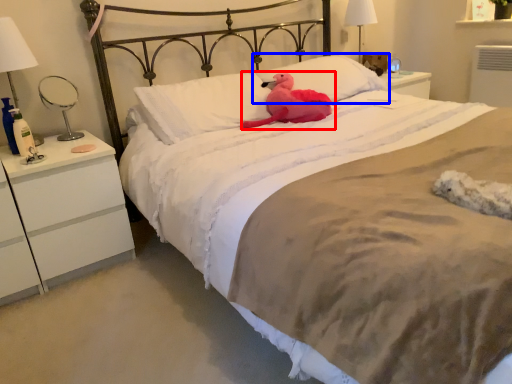
Question: Among these objects, which one is nearest to the camera, animal (highlighted by a red box) or pillow (highlighted by a blue box)?

Choices:
 (A) animal
 (B) pillow

Answer: (A)